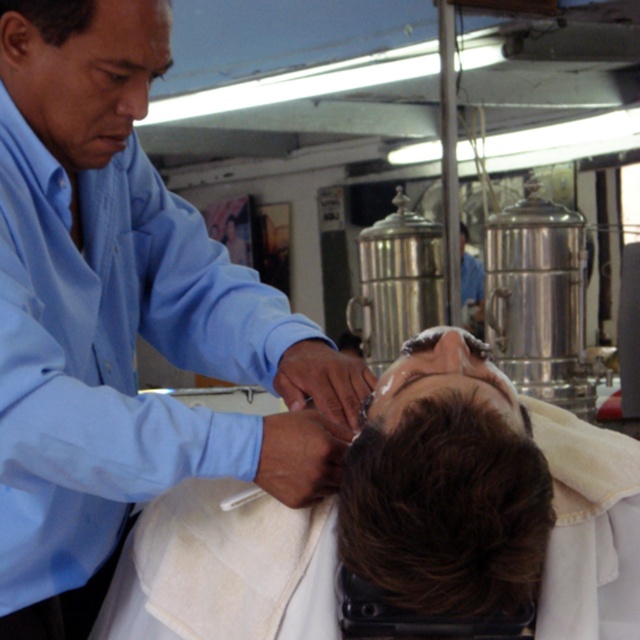
Is smooth skin head at center behind brown matte hair at center?

Yes, smooth skin head at center is behind brown matte hair at center.

Who is shorter, smooth skin head at center or brown matte hair at center?

brown matte hair at center

Is point (497, 595) positioned behind point (474, 490)?

That is True.

At what (x,y) coordinates should I click in order to perform the action: click on smooth skin head at center. Please return your answer as a coordinate pair (x, y). Looking at the image, I should click on (406, 518).

Can you confirm if brown matte hair at center is bigger than blue shirt at upper left?

Yes, brown matte hair at center is bigger than blue shirt at upper left.

Is brown matte hair at center below blue shirt at upper left?

Correct, brown matte hair at center is located below blue shirt at upper left.

Locate an element on the screen. The image size is (640, 640). brown matte hair at center is located at coordinates (444, 513).

Is smooth skin head at center thinner than blue shirt at upper left?

No, smooth skin head at center is not thinner than blue shirt at upper left.

Measure the distance between smooth skin head at center and camera.

97.02 centimeters

Between point (556, 605) and point (49, 54), which one is positioned behind?

Point (49, 54)

Image resolution: width=640 pixels, height=640 pixels. Identify the location of smooth skin head at center. (406, 518).